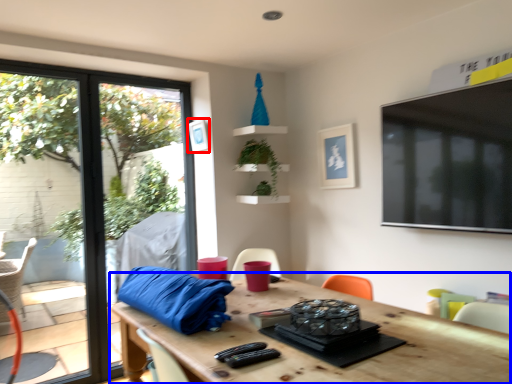
Question: Which object is closer to the camera taking this photo, picture frame (highlighted by a red box) or table (highlighted by a blue box)?

Choices:
 (A) picture frame
 (B) table

Answer: (B)